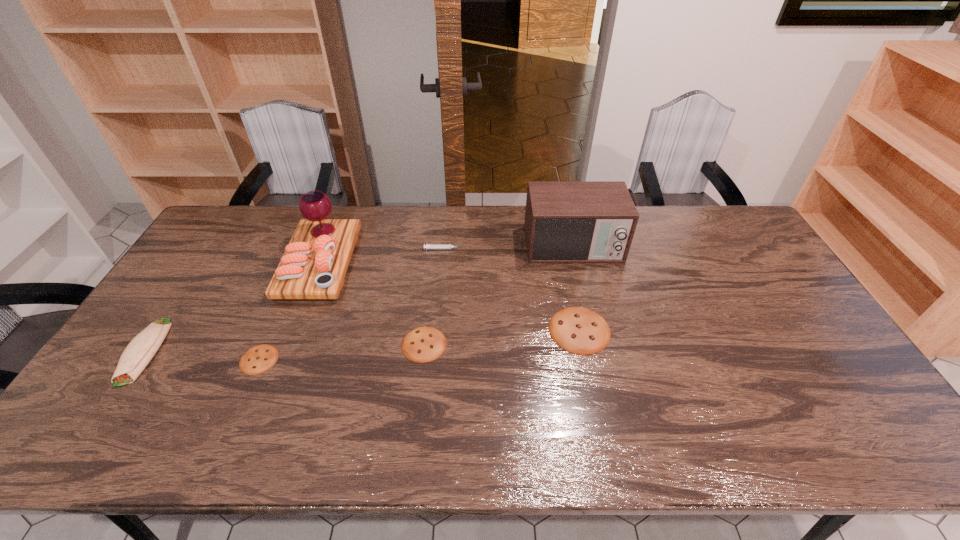
You are a GUI agent. You are given a task and a screenshot of the screen. Output one action in this format:
    pyautogui.click(x=<x>, y=<y>)
    Task: Click on the free space between the burrito and the platter
    
    Given the screenshot: What is the action you would take?
    pyautogui.click(x=232, y=307)

This screenshot has width=960, height=540. Find the location of `empty space between the rightmost cookie and the syringe`. empty space between the rightmost cookie and the syringe is located at coordinates point(512,289).

Where is `free point between the third tallest object and the radio receiver`? This screenshot has height=540, width=960. free point between the third tallest object and the radio receiver is located at coordinates (359, 299).

This screenshot has height=540, width=960. In order to click on vacant region between the tallest cookie and the platter in this screenshot , I will do `click(449, 296)`.

You are a GUI agent. You are given a task and a screenshot of the screen. Output one action in this format:
    pyautogui.click(x=<x>, y=<y>)
    Task: Click on the free space between the platter and the fifth shortest object
    The width and height of the screenshot is (960, 540).
    Given the screenshot: What is the action you would take?
    pyautogui.click(x=232, y=307)

Where is `free spot between the fifth shortest object and the syringe`? free spot between the fifth shortest object and the syringe is located at coordinates (295, 300).

Identify the location of the fourth closest object relative to the rightmost cookie. (315, 262).

Where is `object that ranks as the sixth closest to the second shortest cookie`? object that ranks as the sixth closest to the second shortest cookie is located at coordinates (x=139, y=352).

This screenshot has height=540, width=960. In order to click on cookie identified as the second closest to the syringe in this screenshot , I will do `click(579, 330)`.

Identify the location of cookie that stands as the closest to the burrito. The height and width of the screenshot is (540, 960). (258, 359).